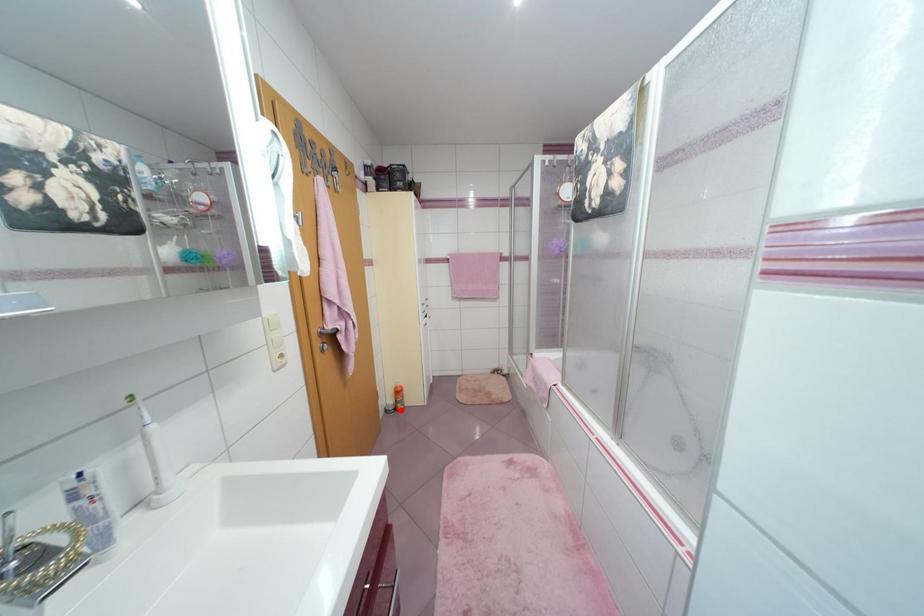
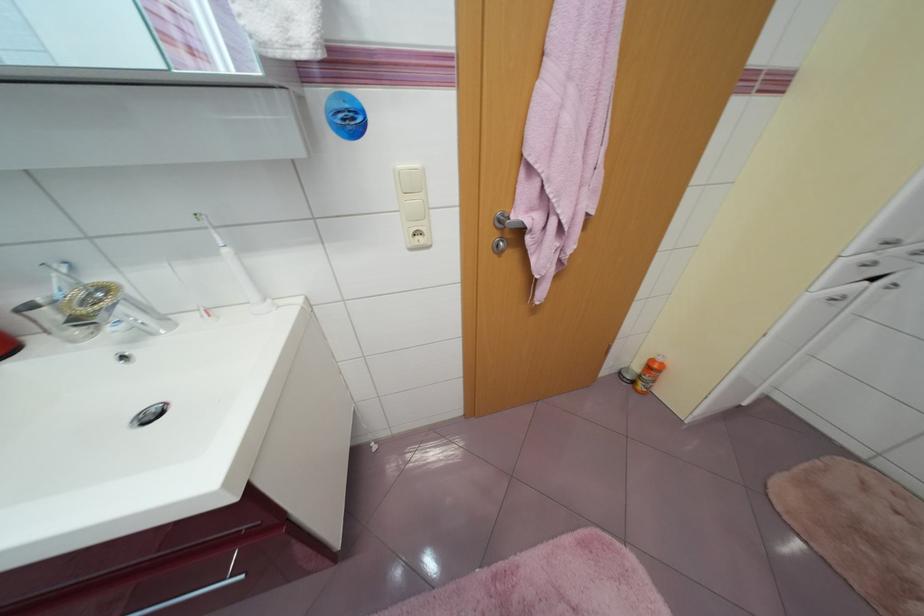
Question: I am providing you with two images of the same scene from different viewpoints. In image1, a red point is highlighted. Considering the same 3D point in image2, which of the following is correct?

Choices:
 (A) It is closer
 (B) It is farther

Answer: (A)